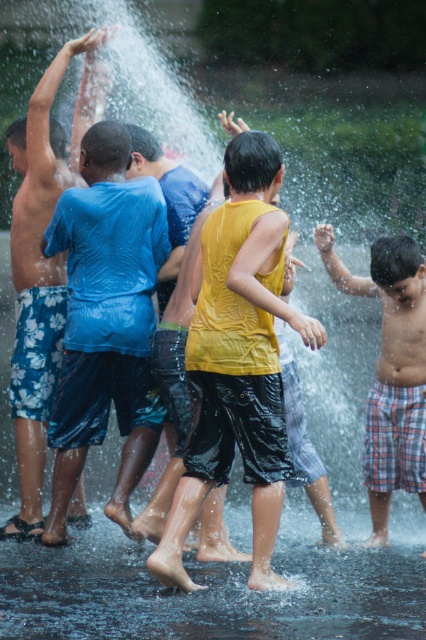
Question: Is yellow shiny tank top at center in front of plaid shorts at right?

Choices:
 (A) yes
 (B) no

Answer: (A)

Question: Can you confirm if yellow shiny tank top at center is positioned below blue floral shorts at left?

Choices:
 (A) no
 (B) yes

Answer: (B)

Question: Which point is farther to the camera?

Choices:
 (A) yellow shiny tank top at center
 (B) plaid shorts at right
 (C) blue floral shorts at left

Answer: (C)

Question: Among these objects, which one is farthest from the camera?

Choices:
 (A) blue floral shorts at left
 (B) plaid shorts at right

Answer: (A)

Question: Can you confirm if blue floral shorts at left is positioned below plaid shorts at right?

Choices:
 (A) no
 (B) yes

Answer: (A)

Question: Which object is the closest to the yellow shiny tank top at center?

Choices:
 (A) plaid shorts at right
 (B) blue floral shorts at left

Answer: (A)